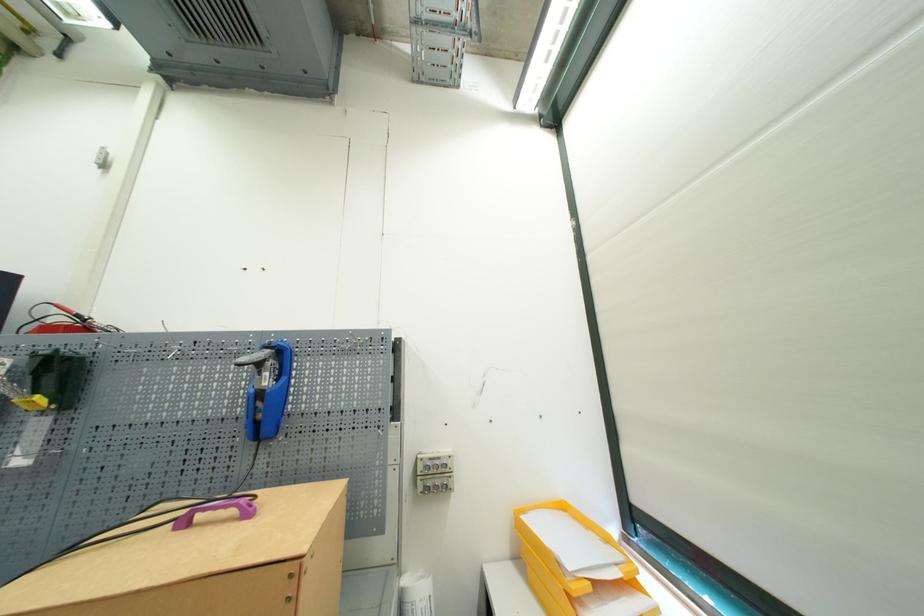
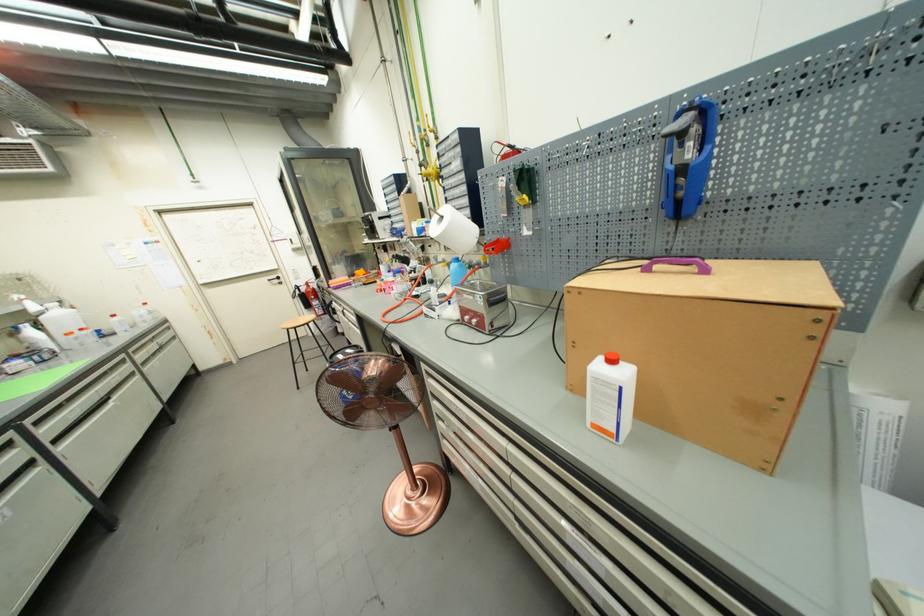
The point at (253, 516) is marked in the first image. Where is the corresponding point in the second image?

(710, 273)